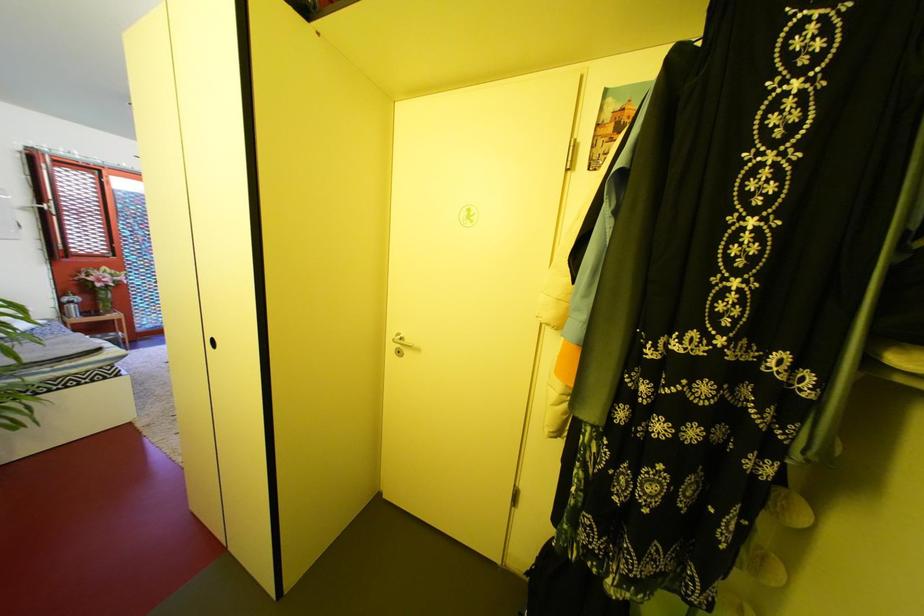
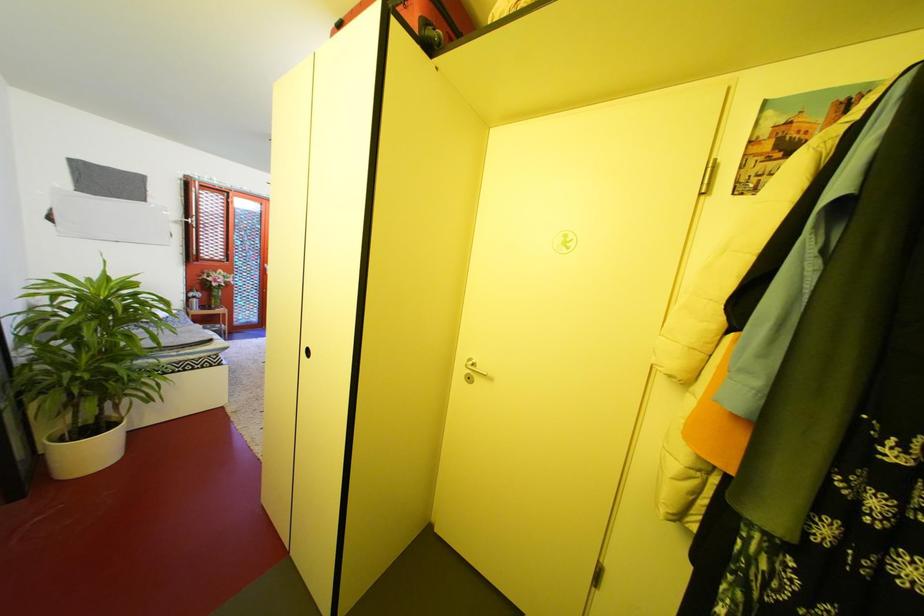
Question: The images are taken continuously from a first-person perspective. In which direction is your viewpoint rotating?

Choices:
 (A) Left
 (B) Right
 (C) Up
 (D) Down

Answer: (A)